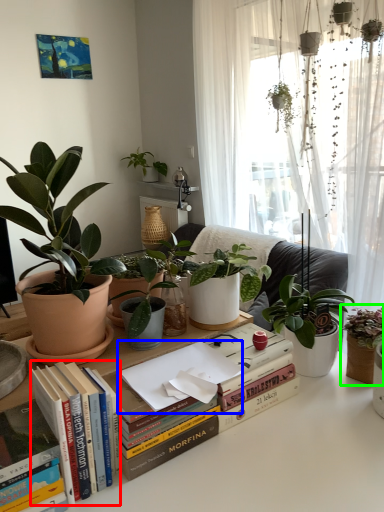
Question: Which is farther away from book (highlighted by a red box)? paperback book (highlighted by a blue box) or houseplant (highlighted by a green box)?

Choices:
 (A) paperback book
 (B) houseplant

Answer: (B)